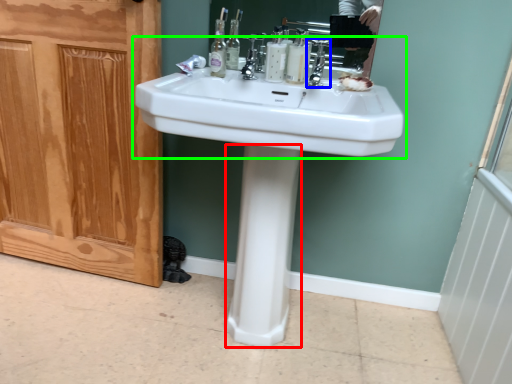
Question: Based on their relative distances, which object is farther from bidet (highlighted by a red box)? Choose from tap (highlighted by a blue box) and sink (highlighted by a green box).

Choices:
 (A) tap
 (B) sink

Answer: (A)